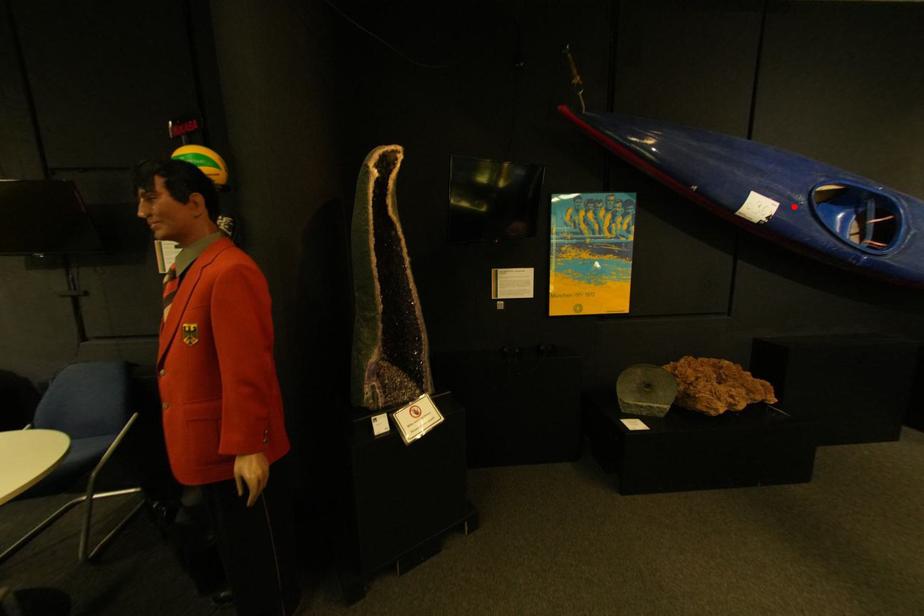
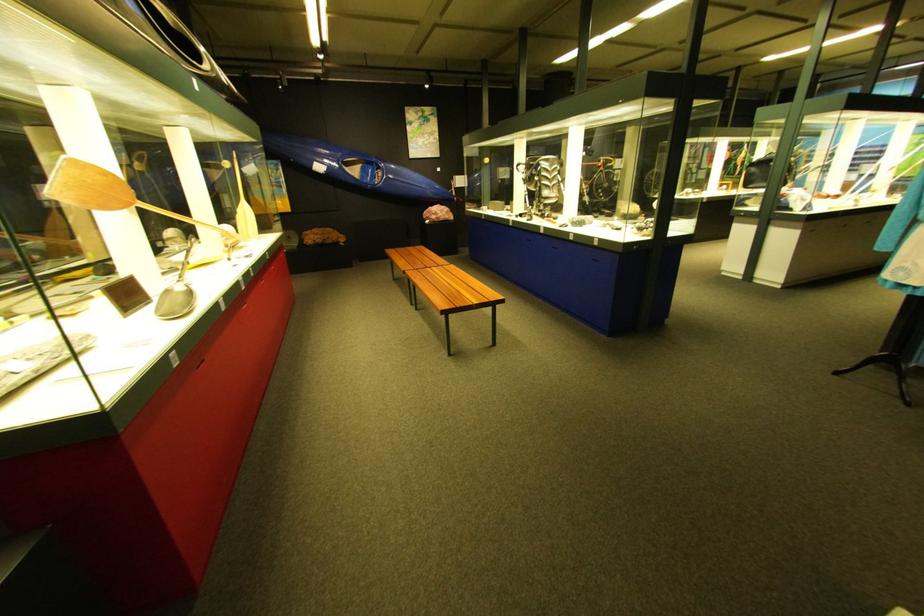
Where in the second image is the point corresponding to the highlighted location from the first image?

(342, 169)